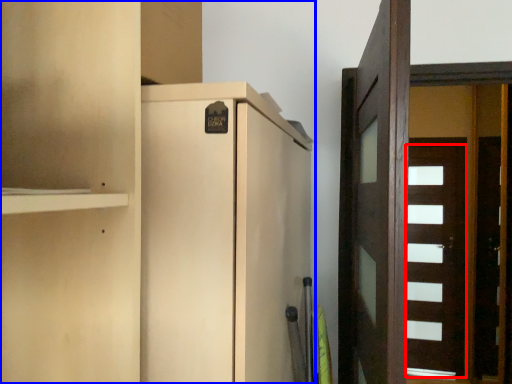
Question: Which object is closer to the camera taking this photo, door (highlighted by a red box) or cupboard (highlighted by a blue box)?

Choices:
 (A) door
 (B) cupboard

Answer: (B)